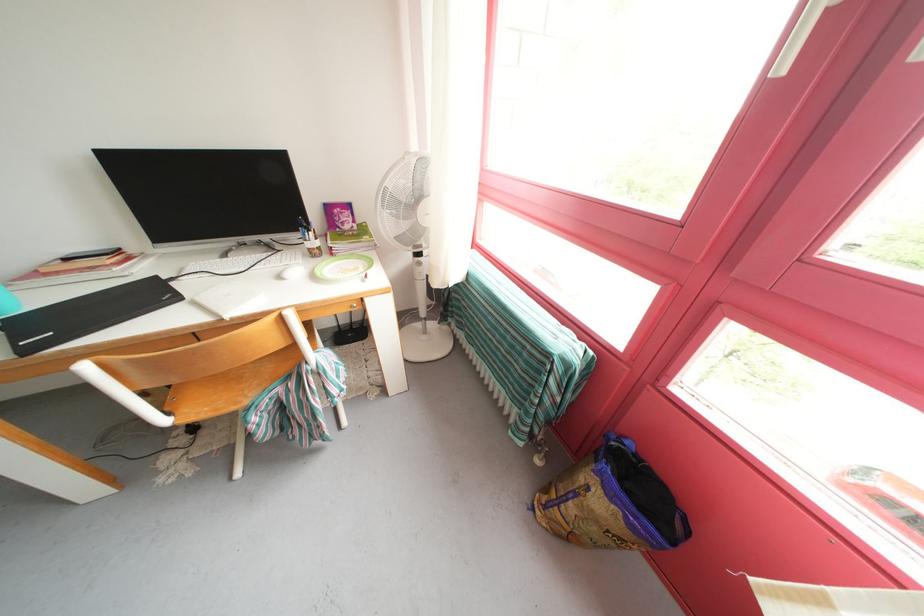
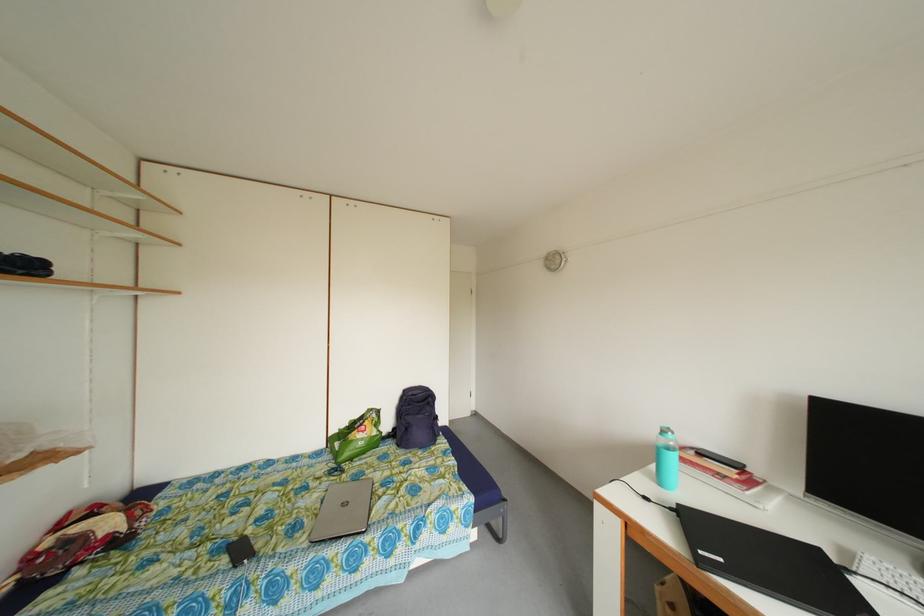
Question: The camera is either moving clockwise (left) or counter-clockwise (right) around the object. The first image is from the beginning of the video and the second image is from the end. Is the camera moving left or right when shooting the video?

Choices:
 (A) Left
 (B) Right

Answer: (B)